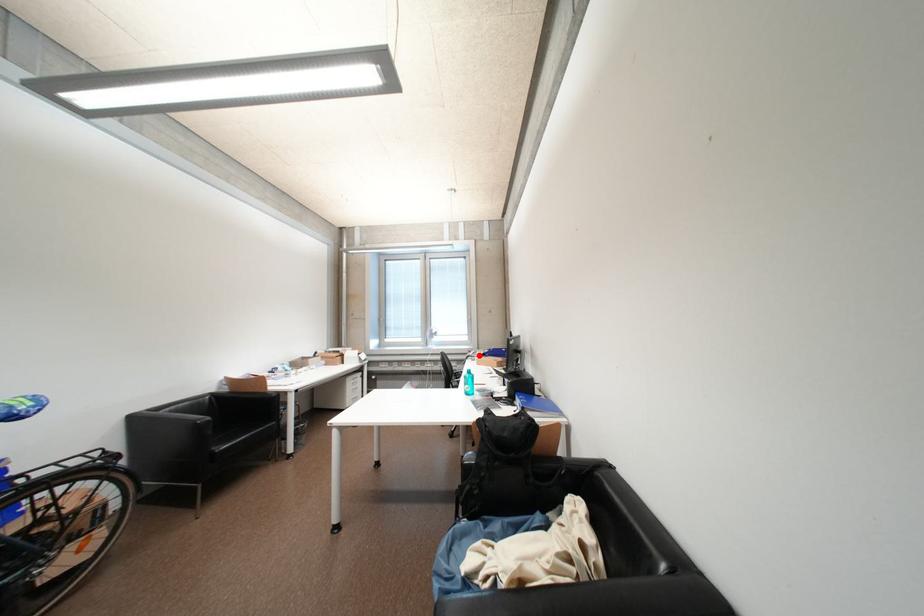
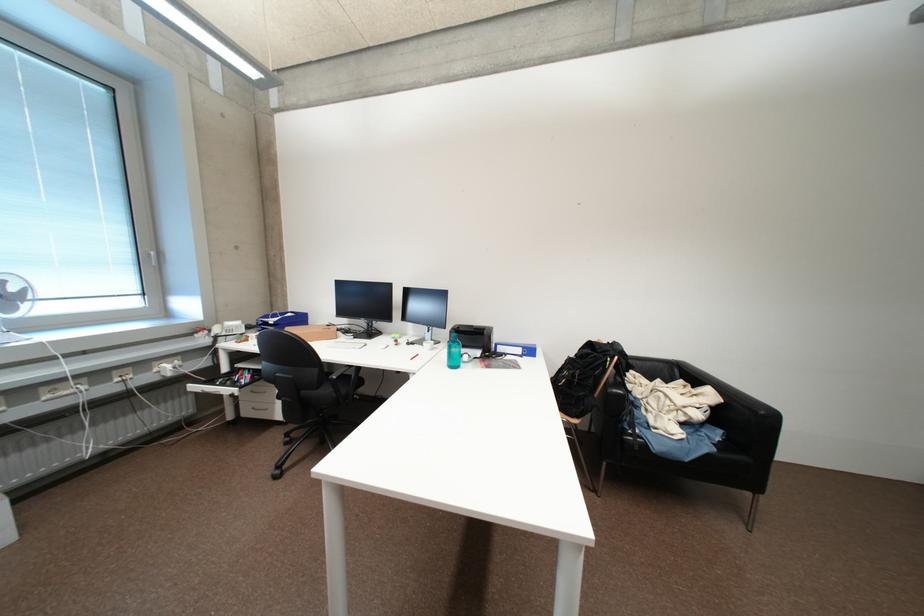
The point at the highlighted location is marked in the first image. Where is the corresponding point in the second image?

(225, 331)